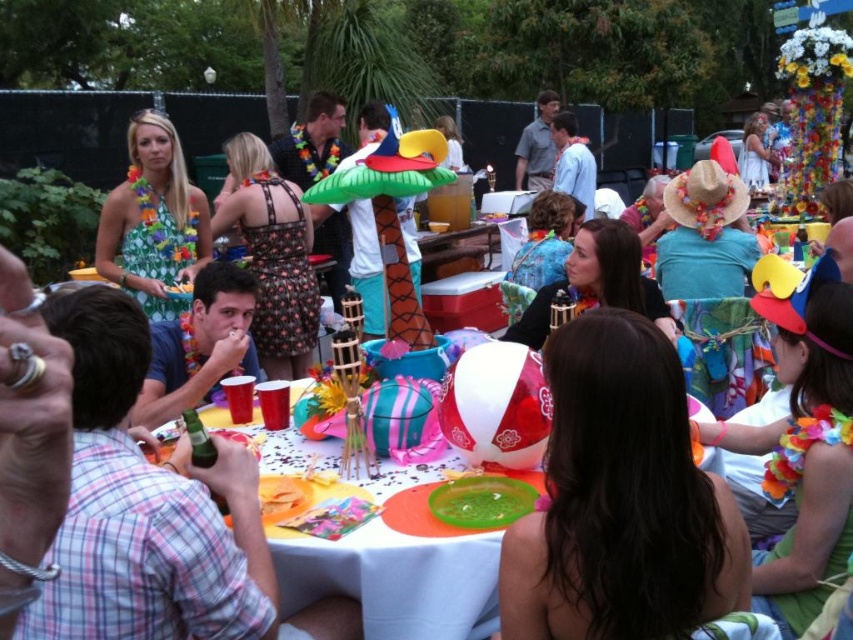
You are at the party and want to hand a drink to the person with dark brown hair at center. The green floral dress at left is in your way. Can you reach the person without moving the dress?

The dark brown hair at center is closer to the viewer than the green floral dress at left, so you can reach the person without moving the dress because they are in front of the dress.

You are at a tropical beach party and see a table with party items. There is a plastic disposable plates at center and a green floral dress at left. Which item is positioned to the right of the other?

The plastic disposable plates at center are to the right of the green floral dress at left.